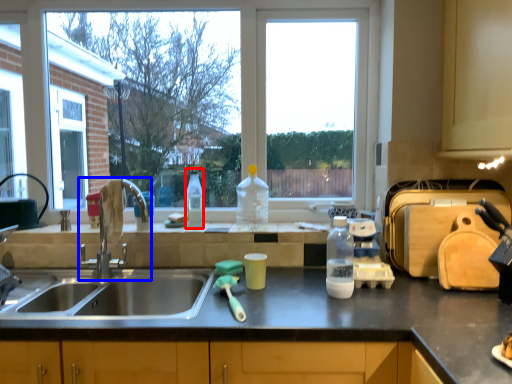
Question: Which point is further to the camera, bottle (highlighted by a red box) or tap (highlighted by a blue box)?

Choices:
 (A) bottle
 (B) tap

Answer: (A)